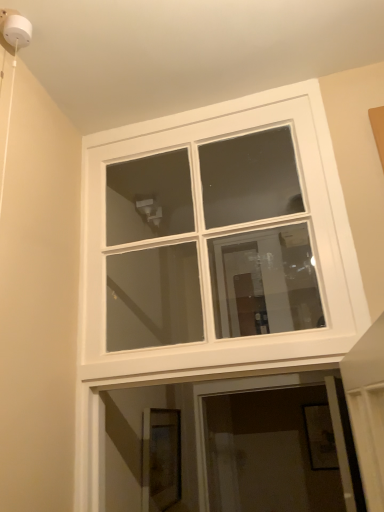
What do you see at coordinates (217, 243) in the screenshot? I see `white glass window at upper center` at bounding box center [217, 243].

Locate an element on the screen. white glass window at upper center is located at coordinates (217, 243).

Measure the distance between point (149, 238) and camera.

The depth of point (149, 238) is 2.13 meters.

What is the approximate height of white glass window at upper center?

It is 31.43 inches.

Where is `white glass window at upper center`? This screenshot has height=512, width=384. white glass window at upper center is located at coordinates point(217,243).